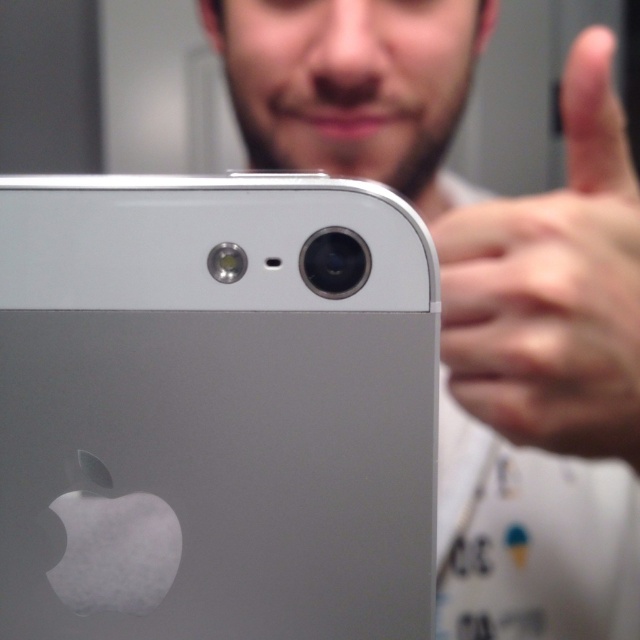
You are looking at two phones displayed side by side on a table. You see the sleek silver phone at center and the matte silver phone at center. Which phone is positioned to the left?

The sleek silver phone at center is positioned to the left of the matte silver phone at center.